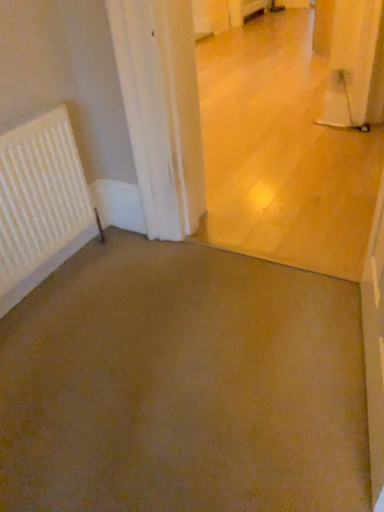
Where is `free location in front of white matte radiator at left`? This screenshot has height=512, width=384. free location in front of white matte radiator at left is located at coordinates (69, 339).